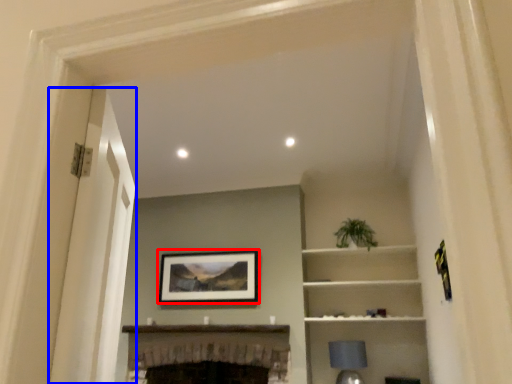
Question: Which object appears closest to the camera in this image, picture frame (highlighted by a red box) or glass door (highlighted by a blue box)?

Choices:
 (A) picture frame
 (B) glass door

Answer: (B)